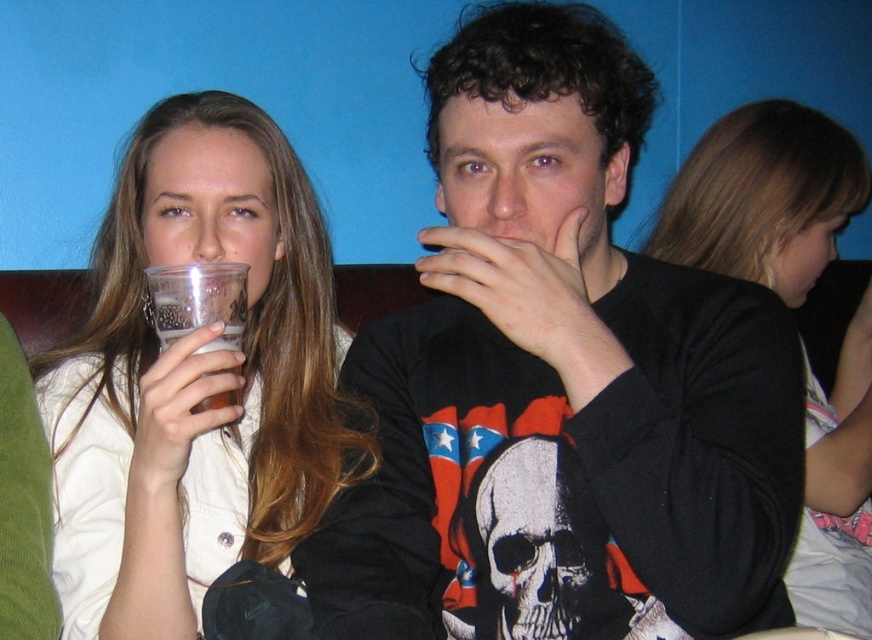
Question: Is blonde hair at upper right smaller than translucent plastic cup at center?

Choices:
 (A) yes
 (B) no

Answer: (B)

Question: Does clear plastic cup at left appear on the left side of translucent plastic cup at center?

Choices:
 (A) yes
 (B) no

Answer: (A)

Question: Which of the following is the farthest from the observer?

Choices:
 (A) (850, 397)
 (B) (222, 339)
 (C) (195, 406)

Answer: (A)

Question: Among these objects, which one is nearest to the camera?

Choices:
 (A) translucent plastic cup at center
 (B) clear plastic cup at left
 (C) black matte sweatshirt at center
 (D) translucent plastic cup at left

Answer: (C)

Question: In this image, where is black matte sweatshirt at center located relative to blonde hair at upper right?

Choices:
 (A) left
 (B) right

Answer: (A)

Question: Among these points, which one is farthest from the camera?

Choices:
 (A) (389, 445)
 (B) (750, 268)
 (C) (237, 333)
 (D) (169, 237)

Answer: (B)